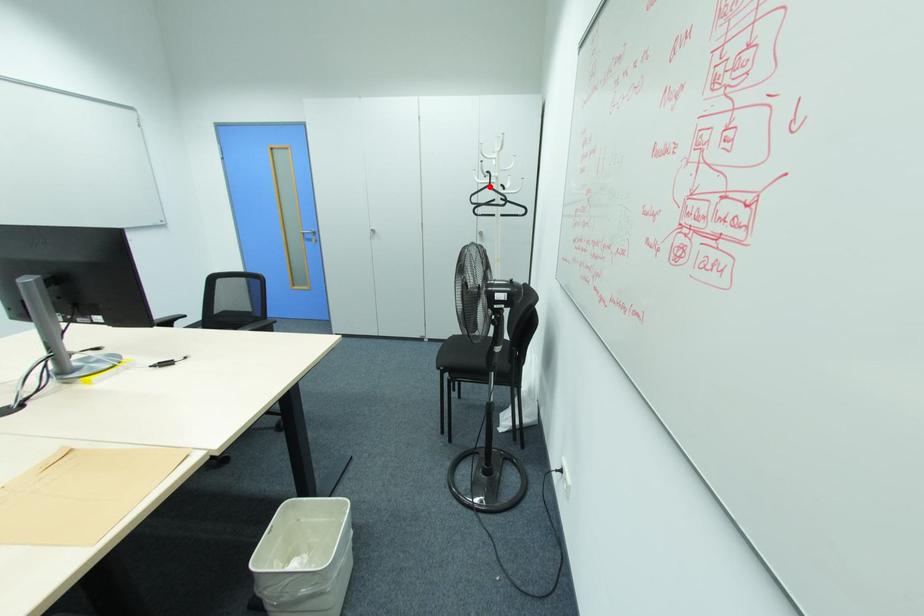
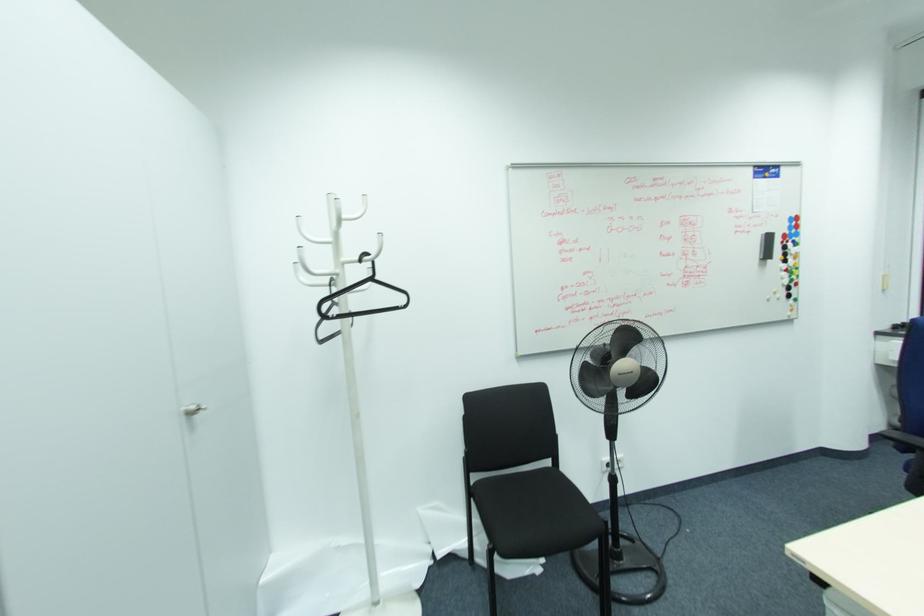
Where in the second image is the point corresponding to the highlighted location from the first image?

(371, 280)